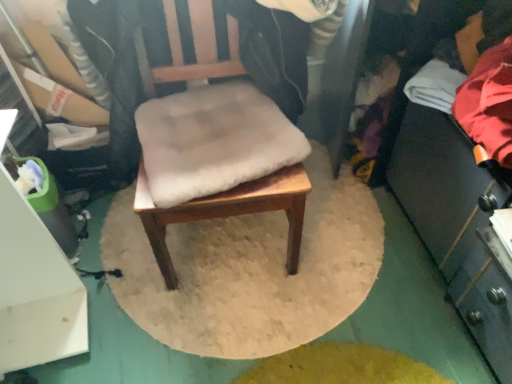
Locate an element on the screen. vacant space in front of wooden chair at center is located at coordinates (223, 331).